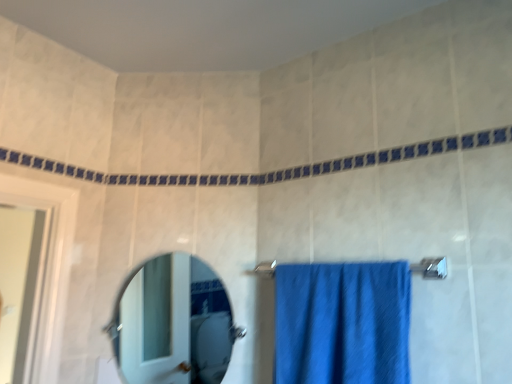
Question: Based on their positions, is blue fabric towel bar at center located to the left or right of polished silver mirror at center?

Choices:
 (A) left
 (B) right

Answer: (B)

Question: Is blue fabric towel bar at center taller or shorter than polished silver mirror at center?

Choices:
 (A) tall
 (B) short

Answer: (B)

Question: Considering the real-world distances, which object is farthest from the blue fabric towel bar at center?

Choices:
 (A) blue fabric towel at center
 (B) polished silver mirror at center

Answer: (B)

Question: Which of these objects is positioned farthest from the polished silver mirror at center?

Choices:
 (A) blue fabric towel at center
 (B) blue fabric towel bar at center

Answer: (B)